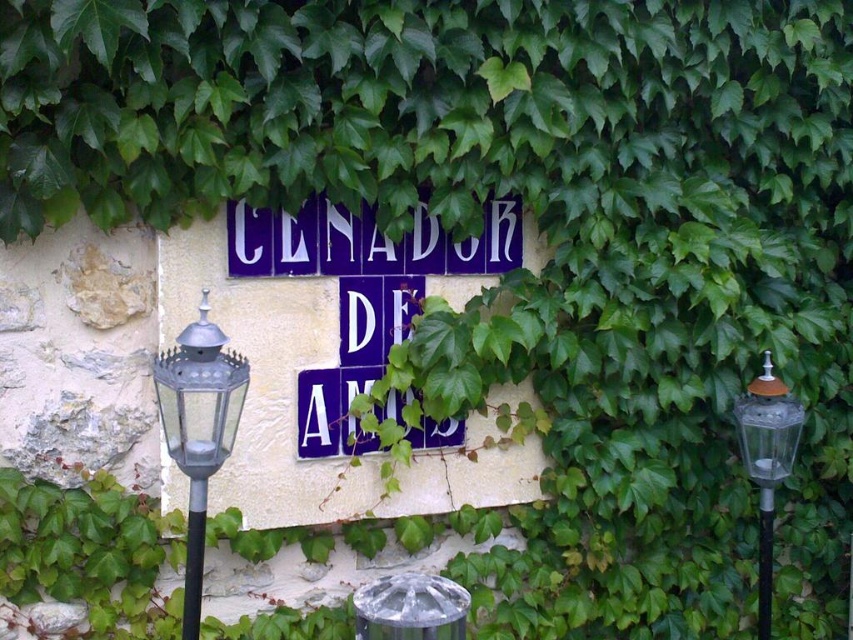
You are standing in front of the ivy covered wall with two purple signs. There are two points marked on the wall at coordinates point (769, 481) and point (189, 602). From your perspective, which point is closer to you?

Point (189, 602) is closer to you because point (769, 481) is behind it.

You are standing in front of the ivy covered wall with the purple signs. There are two glass objects in view. Which one is closer to you, the metallic glass at left or the clear glass lamp post at right?

The metallic glass at left is closer to you because it is in front of the clear glass lamp post at right.

Where is the clear glass lamp post at right located in the image?

The clear glass lamp post at right is located at point (767,461) in the image.